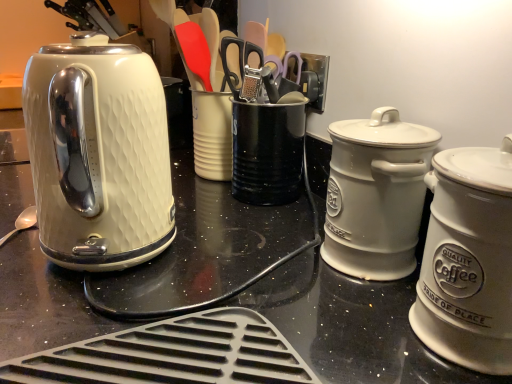
Question: Is white ceramic canister at right, which is counted as the 2th kitchen appliance, starting from the back, further to camera compared to matte white kettle at left?

Choices:
 (A) no
 (B) yes

Answer: (A)

Question: Can you confirm if white ceramic canister at right, marked as the first kitchen appliance in a front-to-back arrangement, is wider than matte white kettle at left?

Choices:
 (A) no
 (B) yes

Answer: (A)

Question: Is white ceramic canister at right, which is counted as the 2th kitchen appliance, starting from the back, located outside matte white kettle at left?

Choices:
 (A) yes
 (B) no

Answer: (A)

Question: Does white ceramic canister at right, which is counted as the 2th kitchen appliance, starting from the back, have a larger size compared to matte white kettle at left?

Choices:
 (A) no
 (B) yes

Answer: (A)

Question: Does white ceramic canister at right, marked as the first kitchen appliance in a front-to-back arrangement, have a greater height compared to matte white kettle at left?

Choices:
 (A) no
 (B) yes

Answer: (A)

Question: Could you tell me if white ceramic canister at right, marked as the first kitchen appliance in a front-to-back arrangement, is facing matte white kettle at left?

Choices:
 (A) yes
 (B) no

Answer: (B)

Question: From a real-world perspective, is white ceramic canister at right, the first kitchen appliance in the back-to-front sequence, over white ceramic canister at right, marked as the first kitchen appliance in a front-to-back arrangement?

Choices:
 (A) yes
 (B) no

Answer: (A)

Question: Is white ceramic canister at right, the second kitchen appliance in the front-to-back sequence, in contact with white ceramic canister at right, which is counted as the 2th kitchen appliance, starting from the back?

Choices:
 (A) no
 (B) yes

Answer: (A)

Question: Would you say white ceramic canister at right, the second kitchen appliance in the front-to-back sequence, is outside white ceramic canister at right, which is counted as the 2th kitchen appliance, starting from the back?

Choices:
 (A) yes
 (B) no

Answer: (A)

Question: Considering the relative positions of white ceramic canister at right, the first kitchen appliance in the back-to-front sequence, and white ceramic canister at right, marked as the first kitchen appliance in a front-to-back arrangement, in the image provided, is white ceramic canister at right, the first kitchen appliance in the back-to-front sequence, to the left of white ceramic canister at right, marked as the first kitchen appliance in a front-to-back arrangement, from the viewer's perspective?

Choices:
 (A) no
 (B) yes

Answer: (B)

Question: From the image's perspective, is white ceramic canister at right, the first kitchen appliance in the back-to-front sequence, below white ceramic canister at right, marked as the first kitchen appliance in a front-to-back arrangement?

Choices:
 (A) no
 (B) yes

Answer: (A)

Question: Does white ceramic canister at right, the first kitchen appliance in the back-to-front sequence, come behind white ceramic canister at right, which is counted as the 2th kitchen appliance, starting from the back?

Choices:
 (A) no
 (B) yes

Answer: (B)

Question: Can we say silver metallic spoon at lower left lies outside matte white kettle at left?

Choices:
 (A) no
 (B) yes

Answer: (B)